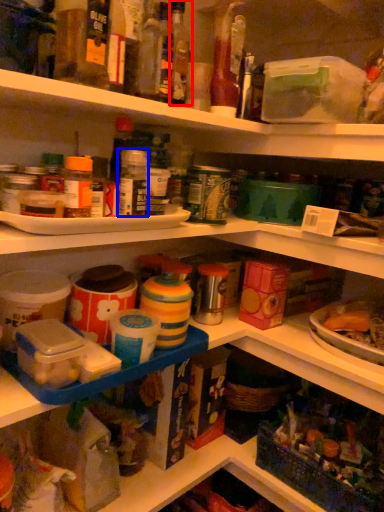
Question: Which object appears farthest to the camera in this image, bottle (highlighted by a red box) or bottle (highlighted by a blue box)?

Choices:
 (A) bottle
 (B) bottle

Answer: (A)